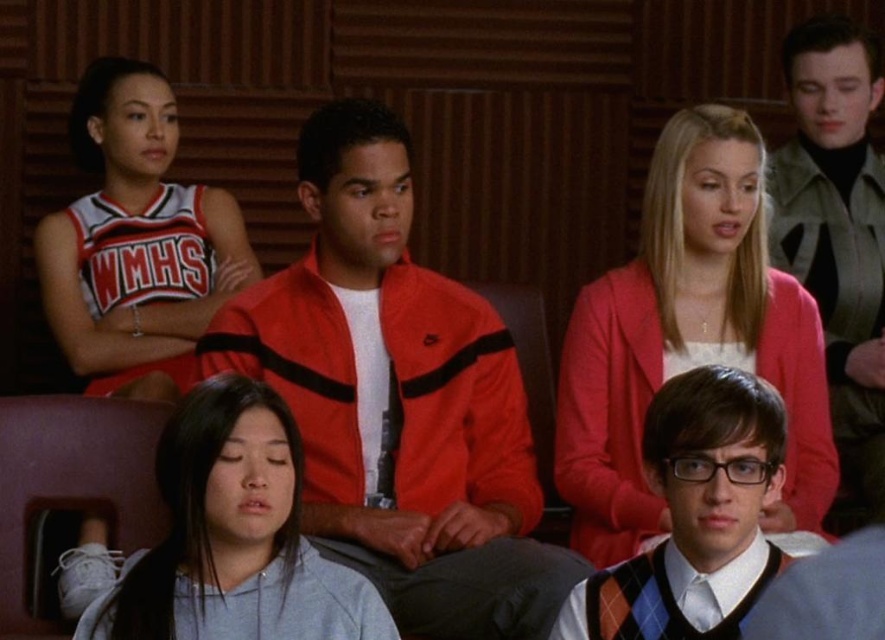
Does gray cotton shirt at lower left have a lesser height compared to argyle sweater vest at center?

Indeed, gray cotton shirt at lower left has a lesser height compared to argyle sweater vest at center.

Does gray cotton shirt at lower left appear on the left side of argyle sweater vest at center?

Indeed, gray cotton shirt at lower left is positioned on the left side of argyle sweater vest at center.

The image size is (885, 640). In order to click on gray cotton shirt at lower left in this screenshot , I will do `click(235, 536)`.

The image size is (885, 640). I want to click on gray cotton shirt at lower left, so click(235, 536).

Between point (225, 513) and point (871, 154), which one is positioned behind?

The point (871, 154) is behind.

Which is above, gray cotton shirt at lower left or gray woolen sweater at upper right?

gray woolen sweater at upper right

You are a GUI agent. You are given a task and a screenshot of the screen. Output one action in this format:
    pyautogui.click(x=<x>, y=<y>)
    Task: Click on the gray cotton shirt at lower left
    
    Given the screenshot: What is the action you would take?
    pyautogui.click(x=235, y=536)

You are a GUI agent. You are given a task and a screenshot of the screen. Output one action in this format:
    pyautogui.click(x=<x>, y=<y>)
    Task: Click on the gray cotton shirt at lower left
    Image resolution: width=885 pixels, height=640 pixels.
    Given the screenshot: What is the action you would take?
    pyautogui.click(x=235, y=536)

Is matte red jacket at center bigger than white jersey at upper left?

Yes.

Which is above, matte red jacket at center or white jersey at upper left?

white jersey at upper left

The width and height of the screenshot is (885, 640). What do you see at coordinates (398, 400) in the screenshot?
I see `matte red jacket at center` at bounding box center [398, 400].

Identify the location of matte red jacket at center. Image resolution: width=885 pixels, height=640 pixels. (398, 400).